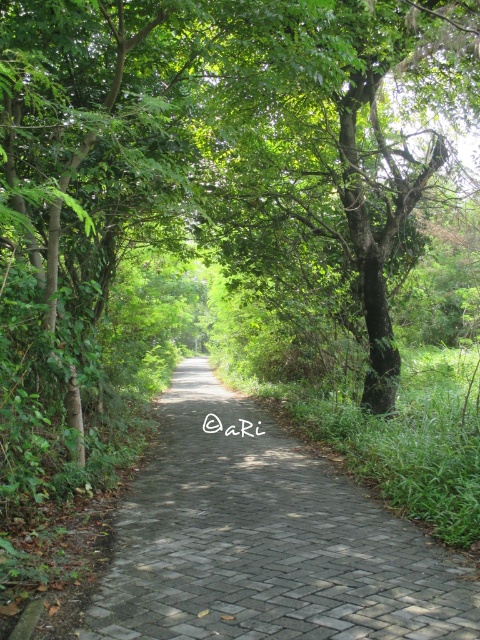
You are standing at the entrance of the pathway and want to walk towards the green leafy tree at center. Which direction should you head to follow the path?

The green leafy tree at center is located at point (212, 170), so you should walk straight along the pathway towards the center to reach it.

You are standing on the paved stone path at center and looking towards the green leafy tree at center. Which object is closer to you?

The paved stone path at center is closer to you because you are standing on it, while the green leafy tree at center is further away.

You are standing on the paved stone path at center and looking towards the green leafy tree at center. Which direction should you walk to avoid the tree branches?

The green leafy tree at center is positioned over the paved stone path at center, so you should walk either to the left or right side of the path to avoid the tree branches.